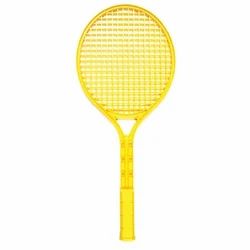
The height and width of the screenshot is (250, 250). In order to click on frame in this screenshot , I will do `click(172, 66)`.